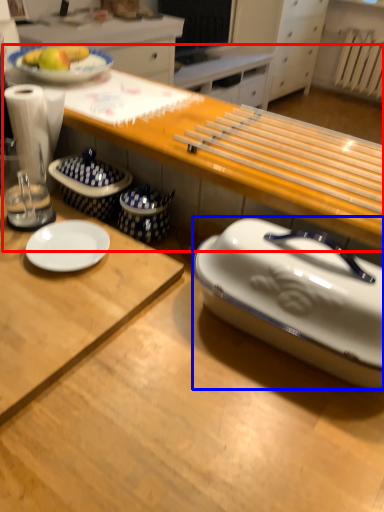
Question: Which of the following is the farthest to the observer, table (highlighted by a red box) or tableware (highlighted by a blue box)?

Choices:
 (A) table
 (B) tableware

Answer: (A)